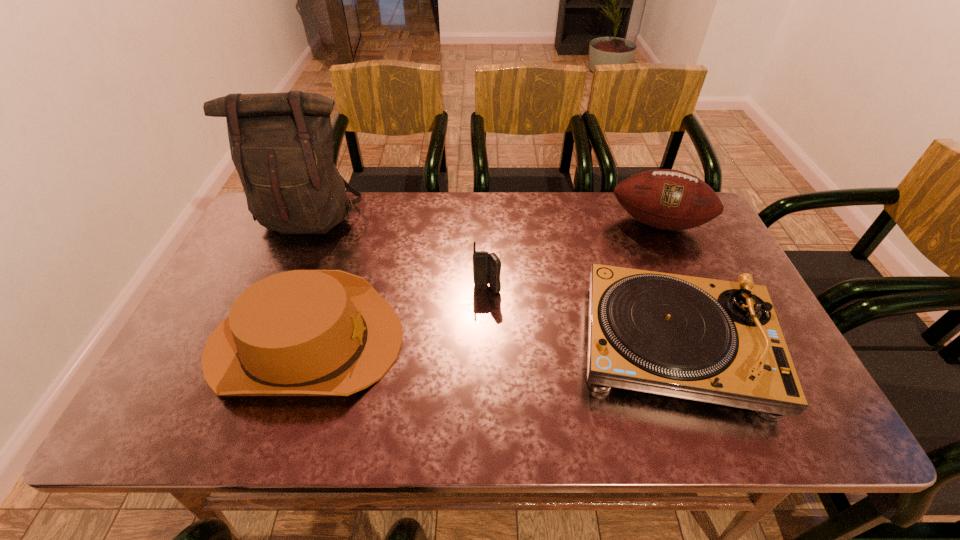
The height and width of the screenshot is (540, 960). Find the location of `backpack`. backpack is located at coordinates (281, 144).

Where is `the fourth shortest object`? The width and height of the screenshot is (960, 540). the fourth shortest object is located at coordinates 668,199.

The height and width of the screenshot is (540, 960). Find the location of `the third object from right to left`. the third object from right to left is located at coordinates (486, 267).

Find the location of a particular element. cowboy hat is located at coordinates (302, 332).

Identify the location of record player. (714, 341).

Find the location of a particular element. The height and width of the screenshot is (540, 960). vacant space located 0.280m on the open flap of the backpack is located at coordinates (267, 319).

Locate an element on the screen. The width and height of the screenshot is (960, 540). vacant space situated on the front of the football (American) is located at coordinates (714, 349).

Image resolution: width=960 pixels, height=540 pixels. I want to click on vacant space located 0.250m on the keyboard of the third object from left to right, so click(x=488, y=377).

Find the location of `vacant space situated on the front-facing side of the cowboy hat`. vacant space situated on the front-facing side of the cowboy hat is located at coordinates (427, 342).

Find the location of `vacant position located 0.120m on the back of the record player`. vacant position located 0.120m on the back of the record player is located at coordinates (641, 254).